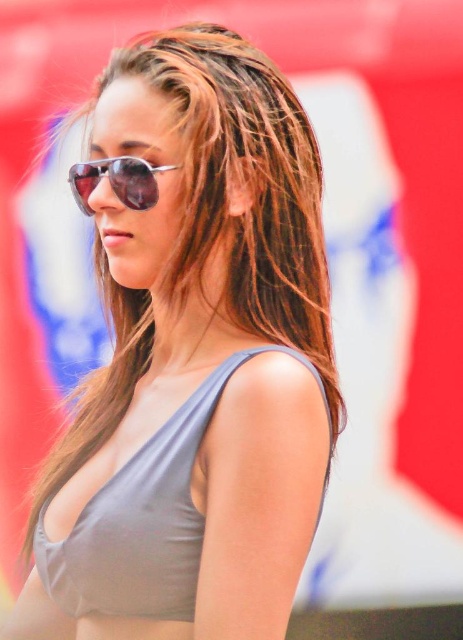
You are a photographer trying to capture the model wearing both the matte gray tank top at center and the matte gray bikini top at center. Since the tank top is covering the bikini top, can you still see the bikini top in the image?

The matte gray tank top at center is located above the matte gray bikini top at center, so the bikini top is covered and cannot be seen in the image.

You are a photographer setting up a shoot. You need to ensure that the matte gray bikini top at center and the matte gray belly at center are framed properly. Which object is wider in the image?

The matte gray bikini top at center is wider than the matte gray belly at center.